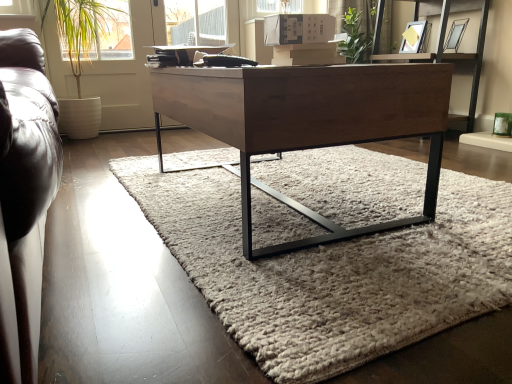
Question: Can you confirm if soft gray wool rug at center is positioned to the left of wooden desk at center?

Choices:
 (A) no
 (B) yes

Answer: (A)

Question: Is soft gray wool rug at center not close to wooden desk at center?

Choices:
 (A) no
 (B) yes

Answer: (A)

Question: From a real-world perspective, is soft gray wool rug at center located higher than wooden desk at center?

Choices:
 (A) yes
 (B) no

Answer: (B)

Question: Is soft gray wool rug at center not within wooden desk at center?

Choices:
 (A) yes
 (B) no

Answer: (A)

Question: Is soft gray wool rug at center placed right next to wooden desk at center?

Choices:
 (A) yes
 (B) no

Answer: (B)

Question: Visually, is wooden shelf at upper center positioned to the left or to the right of wooden desk at center?

Choices:
 (A) left
 (B) right

Answer: (B)

Question: Is wooden shelf at upper center spatially inside wooden desk at center, or outside of it?

Choices:
 (A) inside
 (B) outside

Answer: (B)

Question: From their relative heights in the image, would you say wooden shelf at upper center is taller or shorter than wooden desk at center?

Choices:
 (A) short
 (B) tall

Answer: (B)

Question: Does point 376,13 appear closer or farther from the camera than point 330,241?

Choices:
 (A) closer
 (B) farther

Answer: (B)

Question: Based on their positions, is soft gray wool rug at center located to the left or right of wooden desk at center?

Choices:
 (A) left
 (B) right

Answer: (B)

Question: Would you say soft gray wool rug at center is inside or outside wooden desk at center?

Choices:
 (A) inside
 (B) outside

Answer: (B)

Question: Relative to wooden desk at center, is soft gray wool rug at center in front or behind?

Choices:
 (A) behind
 (B) front

Answer: (B)

Question: From the image's perspective, is soft gray wool rug at center positioned above or below wooden desk at center?

Choices:
 (A) below
 (B) above

Answer: (A)

Question: Choose the correct answer: Is green leafy plant at left inside wooden desk at center or outside it?

Choices:
 (A) outside
 (B) inside

Answer: (A)

Question: Considering the positions of green leafy plant at left and wooden desk at center in the image, is green leafy plant at left bigger or smaller than wooden desk at center?

Choices:
 (A) small
 (B) big

Answer: (A)